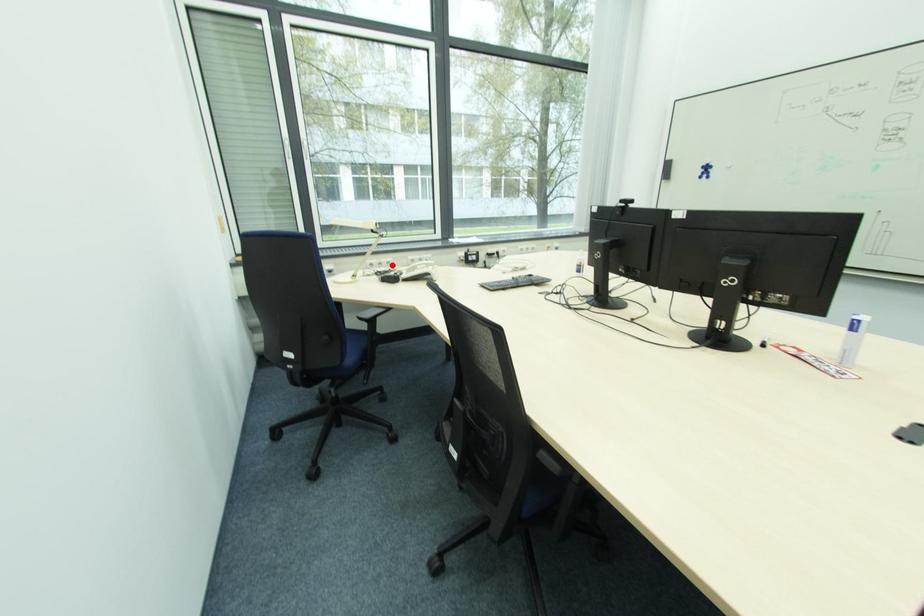
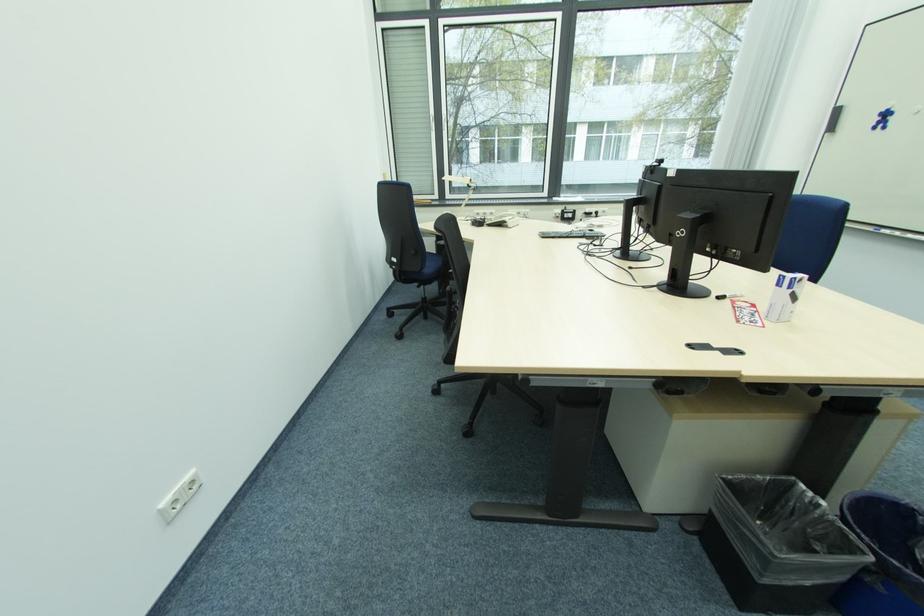
Find the pixel in the second image that matches the highlighted location in the first image.

(494, 216)